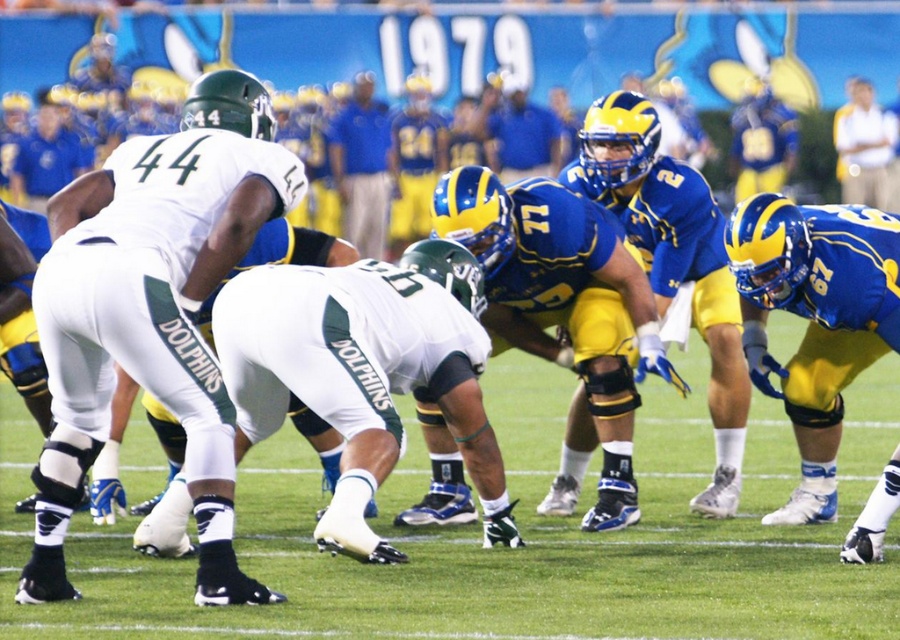
Which of these two, white matte uniform at center or light yellow shirt at upper right, stands taller?

Standing taller between the two is white matte uniform at center.

From the picture: Does white matte uniform at center have a larger size compared to light yellow shirt at upper right?

Yes.

Who is more distant from viewer, (208, 93) or (884, 173)?

Point (884, 173)

Where is `white matte uniform at center`? The height and width of the screenshot is (640, 900). white matte uniform at center is located at coordinates (154, 310).

The height and width of the screenshot is (640, 900). What do you see at coordinates (362, 166) in the screenshot?
I see `blue fabric shirt at center` at bounding box center [362, 166].

Which is more to the left, blue fabric shirt at center or blue jersey at center?

blue fabric shirt at center is more to the left.

Who is more forward, (356, 160) or (522, 125)?

Point (356, 160) is in front.

Where is `blue fabric shirt at center`? blue fabric shirt at center is located at coordinates (362, 166).

Does white matte uniform at center appear on the left side of blue matte football player at center?

Indeed, white matte uniform at center is positioned on the left side of blue matte football player at center.

Who is more forward, (75, 500) or (691, 186)?

Point (75, 500) is more forward.

Where is `white matte uniform at center`? white matte uniform at center is located at coordinates (154, 310).